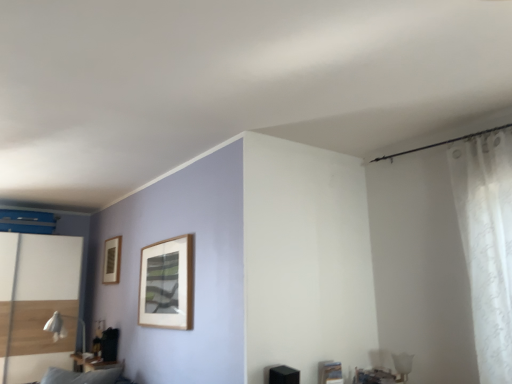
Question: Is white fabric table lamp at lower left completely or partially outside of white sheer curtain at right?

Choices:
 (A) no
 (B) yes

Answer: (B)

Question: From a real-world perspective, is white fabric table lamp at lower left physically below white sheer curtain at right?

Choices:
 (A) yes
 (B) no

Answer: (A)

Question: Does white fabric table lamp at lower left appear on the right side of white sheer curtain at right?

Choices:
 (A) yes
 (B) no

Answer: (B)

Question: From the image's perspective, does white fabric table lamp at lower left appear lower than white sheer curtain at right?

Choices:
 (A) no
 (B) yes

Answer: (B)

Question: Does white fabric table lamp at lower left have a greater height compared to white sheer curtain at right?

Choices:
 (A) no
 (B) yes

Answer: (A)

Question: Is white fabric table lamp at lower left not near white sheer curtain at right?

Choices:
 (A) yes
 (B) no

Answer: (A)

Question: Considering the relative sizes of white sheer curtain at right and white fabric table lamp at lower left in the image provided, is white sheer curtain at right wider than white fabric table lamp at lower left?

Choices:
 (A) no
 (B) yes

Answer: (A)

Question: From a real-world perspective, is white sheer curtain at right positioned under white fabric table lamp at lower left based on gravity?

Choices:
 (A) yes
 (B) no

Answer: (B)

Question: Does white sheer curtain at right have a larger size compared to white fabric table lamp at lower left?

Choices:
 (A) no
 (B) yes

Answer: (B)

Question: Can you confirm if white sheer curtain at right is taller than white fabric table lamp at lower left?

Choices:
 (A) no
 (B) yes

Answer: (B)

Question: Does white sheer curtain at right contain white fabric table lamp at lower left?

Choices:
 (A) yes
 (B) no

Answer: (B)

Question: Is white sheer curtain at right positioned with its back to white fabric table lamp at lower left?

Choices:
 (A) yes
 (B) no

Answer: (B)

Question: Does white glossy screen door at left appear on the left side of white sheer curtain at right?

Choices:
 (A) yes
 (B) no

Answer: (A)